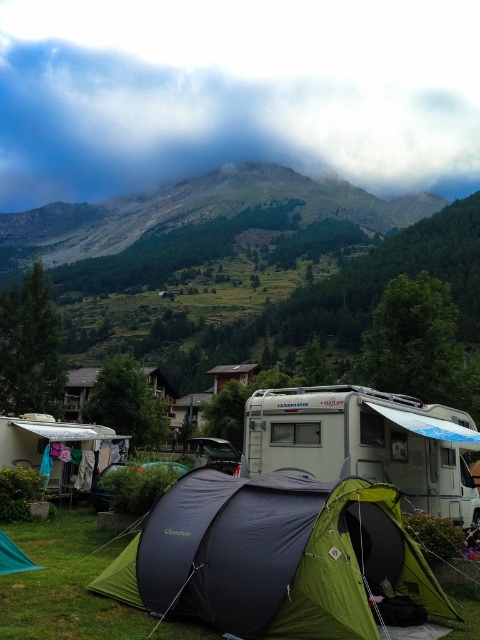
Who is higher up, green fabric tent at center or metallic silver recreational vehicle at center?

Positioned higher is green fabric tent at center.

Is green fabric tent at center thinner than metallic silver recreational vehicle at center?

Incorrect, green fabric tent at center's width is not less than metallic silver recreational vehicle at center's.

Locate an element on the screen. green fabric tent at center is located at coordinates (273, 556).

Does cloudy sky at upper center have a smaller size compared to green fabric tent at center?

Actually, cloudy sky at upper center might be larger than green fabric tent at center.

The height and width of the screenshot is (640, 480). Describe the element at coordinates (232, 115) in the screenshot. I see `cloudy sky at upper center` at that location.

Identify the location of cloudy sky at upper center. The height and width of the screenshot is (640, 480). (232, 115).

Between cloudy sky at upper center and white plastic camper at center, which one has more height?

With more height is cloudy sky at upper center.

From the picture: Can you confirm if cloudy sky at upper center is positioned to the right of white plastic camper at center?

In fact, cloudy sky at upper center is to the left of white plastic camper at center.

Between point (441, 90) and point (369, 461), which one is positioned behind?

The point (441, 90) is behind.

Where is `cloudy sky at upper center`? The image size is (480, 640). cloudy sky at upper center is located at coordinates (232, 115).